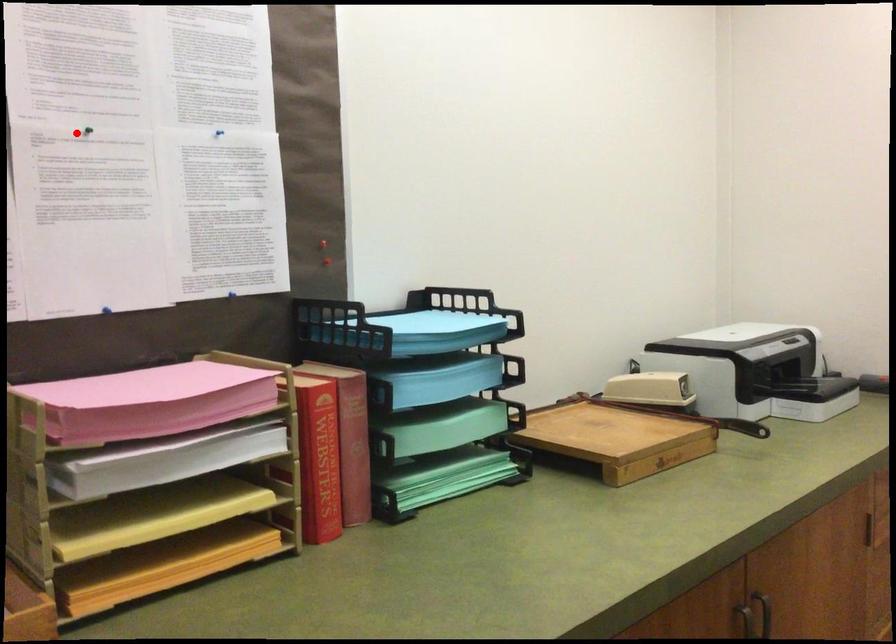
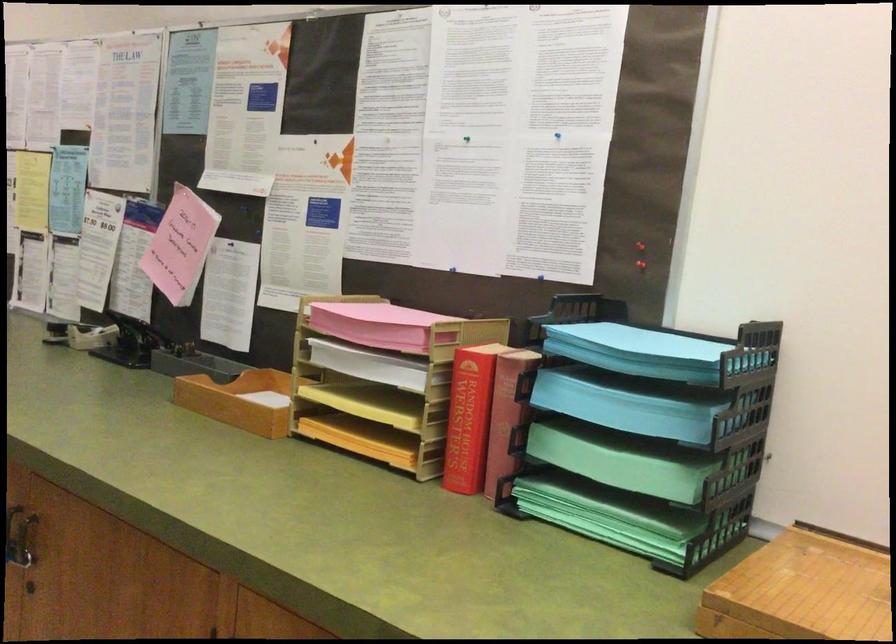
Question: I am providing you with two images of the same scene from different viewpoints. In image1, a red point is highlighted. Considering the same 3D point in image2, which of the following is correct?

Choices:
 (A) It is closer
 (B) It is farther

Answer: (B)